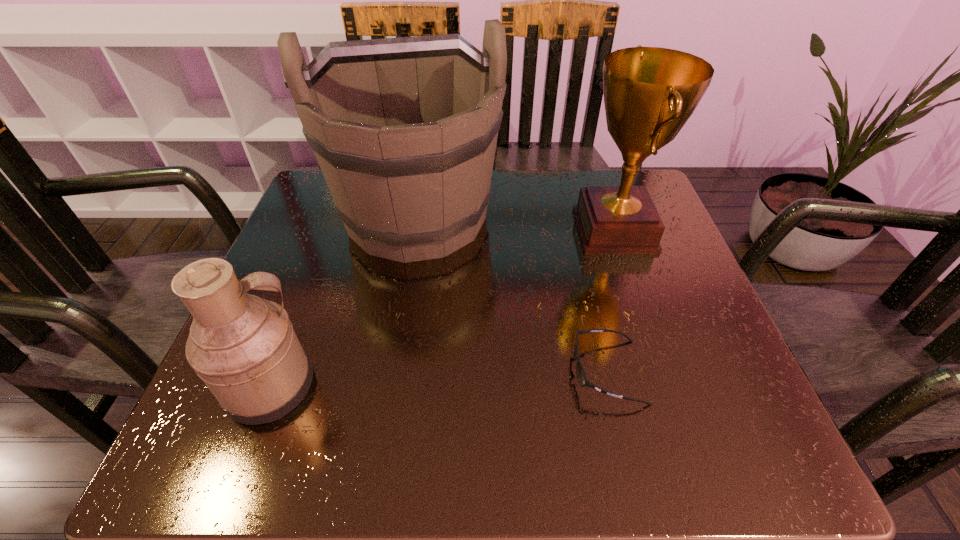
You are a GUI agent. You are given a task and a screenshot of the screen. Output one action in this format:
    pyautogui.click(x=<x>, y=<y>)
    Task: Click on the object present at the near left corner
    The image size is (960, 540).
    Given the screenshot: What is the action you would take?
    pyautogui.click(x=244, y=348)

Find the location of `object situated at the far right corner`. object situated at the far right corner is located at coordinates (649, 93).

The width and height of the screenshot is (960, 540). Find the location of `vacant space at the far edge of the desktop`. vacant space at the far edge of the desktop is located at coordinates (511, 191).

I want to click on vacant region at the near edge of the desktop, so click(x=541, y=451).

This screenshot has height=540, width=960. Find the location of `free space at the left edge of the desktop`. free space at the left edge of the desktop is located at coordinates (328, 261).

In the image, there is a desktop. Identify the location of free space at the right edge. This screenshot has width=960, height=540. (660, 259).

This screenshot has width=960, height=540. Find the location of `free space at the far left corner of the desktop`. free space at the far left corner of the desktop is located at coordinates (321, 211).

Where is `empty location between the shortest object and the second shortest object`? empty location between the shortest object and the second shortest object is located at coordinates 439,379.

Where is `free space between the bucket and the award`? The image size is (960, 540). free space between the bucket and the award is located at coordinates (516, 223).

I want to click on vacant space that's between the award and the bucket, so click(x=516, y=223).